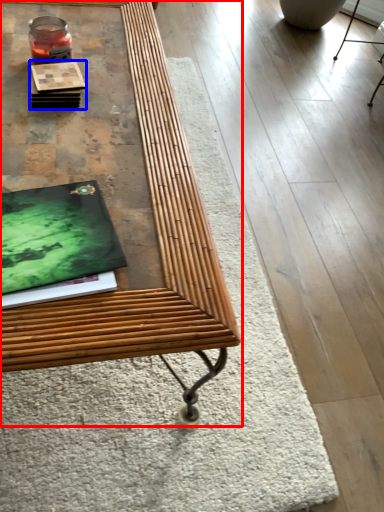
Question: Which object appears farthest to the camera in this image, table (highlighted by a red box) or book (highlighted by a blue box)?

Choices:
 (A) table
 (B) book

Answer: (B)